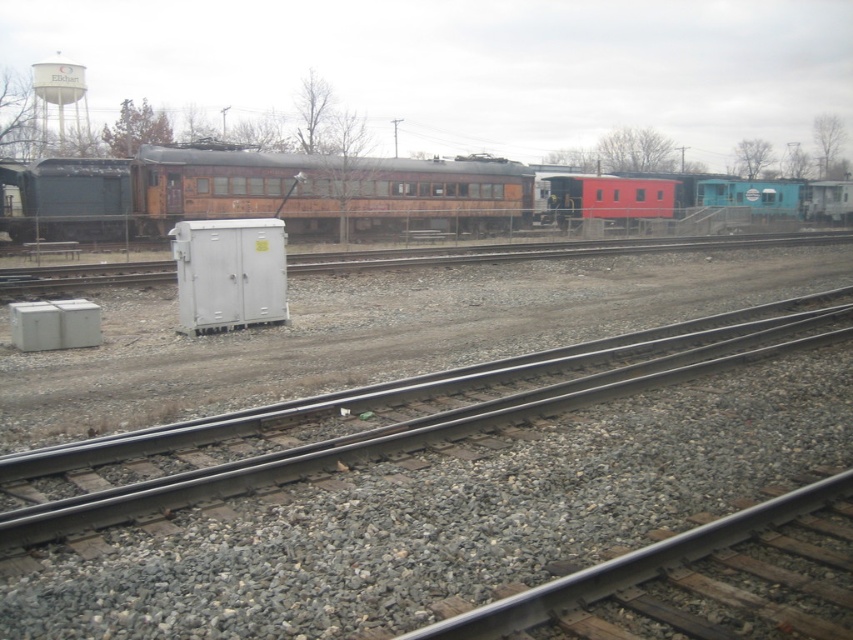
Does gray gravel at lower left have a lesser height compared to smooth red caboose at center?

Correct, gray gravel at lower left is not as tall as smooth red caboose at center.

Looking at this image, can you confirm if gray gravel at lower left is positioned above smooth red caboose at center?

Actually, gray gravel at lower left is below smooth red caboose at center.

What do you see at coordinates (631, 566) in the screenshot? This screenshot has width=853, height=640. I see `gray gravel at lower left` at bounding box center [631, 566].

Locate an element on the screen. gray gravel at lower left is located at coordinates (631, 566).

Between wooden train car at center and gray gravel at lower left, which one appears on the left side from the viewer's perspective?

wooden train car at center

Is point (76, 180) less distant than point (560, 595)?

No, it is behind (560, 595).

Locate an element on the screen. wooden train car at center is located at coordinates (262, 193).

Which is below, gray metallic train track at center or gray gravel at lower left?

gray gravel at lower left is below.

Is point (86, 440) farther from camera compared to point (816, 497)?

That is True.

Is point (694, 374) positioned after point (793, 502)?

That is True.

This screenshot has width=853, height=640. I want to click on gray metallic train track at center, so click(x=397, y=416).